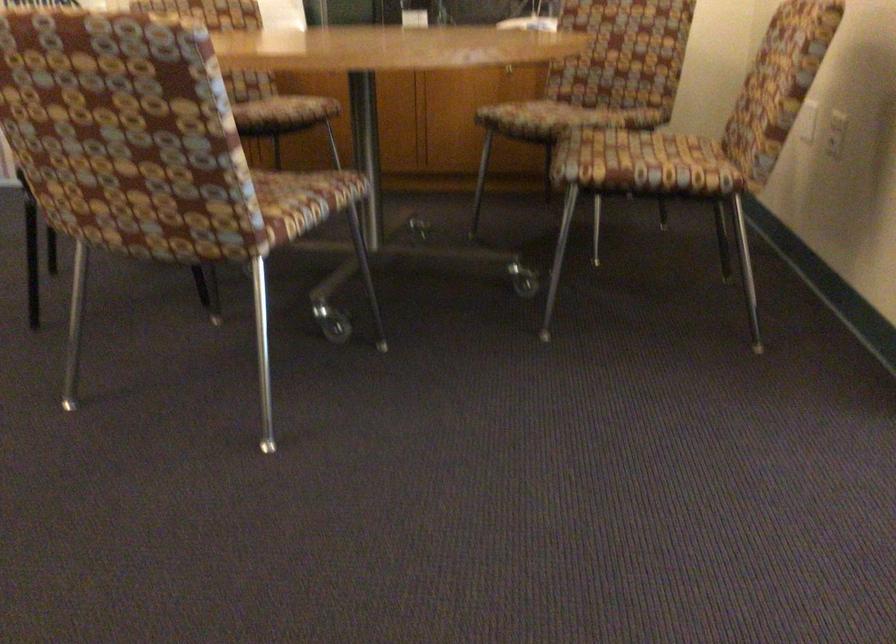
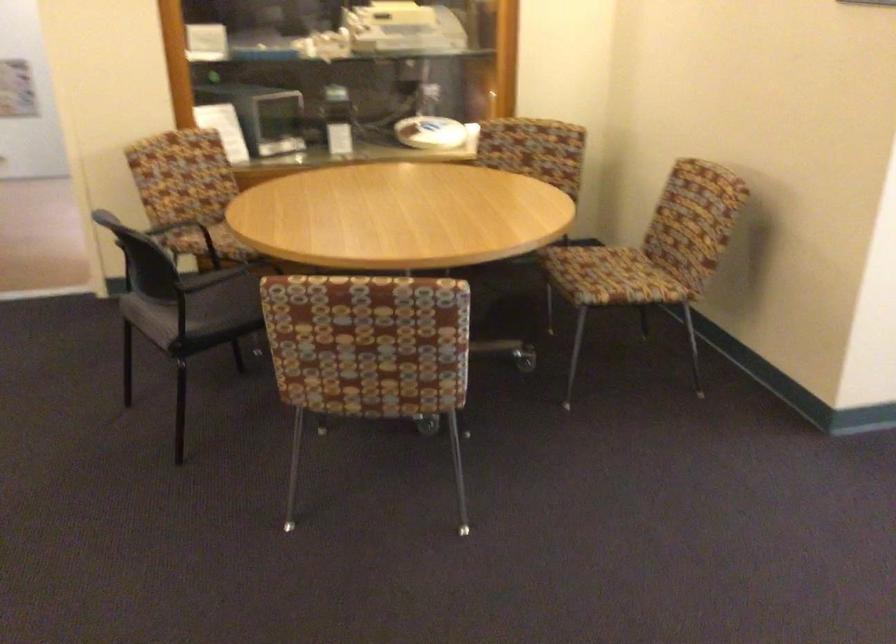
Find the pixel in the second image that matches the point at 102,145 in the first image.

(368, 353)